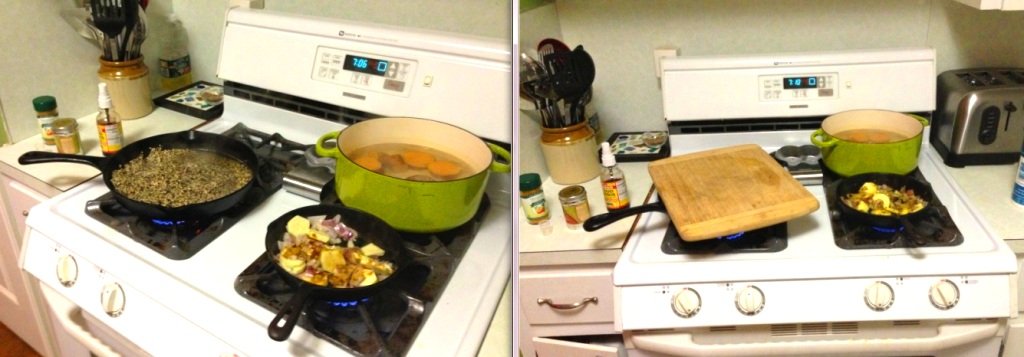
Locate an element on the screen. This screenshot has width=1024, height=357. small skillet is located at coordinates tap(329, 254).